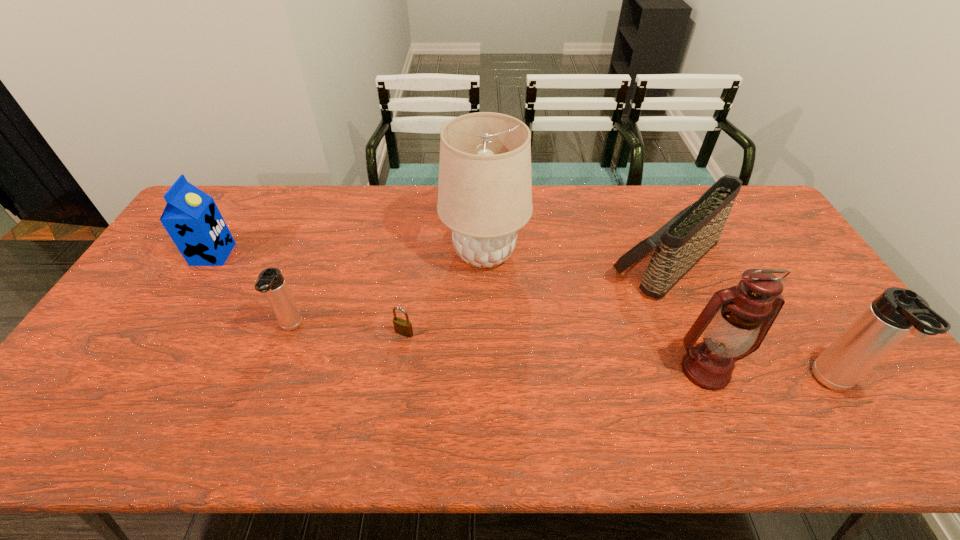
The width and height of the screenshot is (960, 540). Identify the location of object located in the left edge section of the desktop. (191, 217).

The width and height of the screenshot is (960, 540). Find the location of `object that is at the right edge`. object that is at the right edge is located at coordinates (897, 312).

This screenshot has height=540, width=960. Identify the location of object located in the near right corner section of the desktop. (897, 312).

In the image, there is a desktop. Where is `vacant space at the far edge`? vacant space at the far edge is located at coordinates (433, 224).

Where is `vacant space at the near edge of the desktop`? vacant space at the near edge of the desktop is located at coordinates (328, 372).

Identify the location of free location at the left edge. The width and height of the screenshot is (960, 540). (180, 262).

In the image, there is a desktop. At what (x,y) coordinates should I click in order to perform the action: click on vacant space at the right edge. Please return your answer as a coordinate pair (x, y). Looking at the image, I should click on (810, 273).

In the image, there is a desktop. At what (x,y) coordinates should I click in order to perform the action: click on vacant space at the far left corner. Please return your answer as a coordinate pair (x, y). Image resolution: width=960 pixels, height=540 pixels. Looking at the image, I should click on (230, 185).

This screenshot has height=540, width=960. What are the coordinates of `blank space at the near left corner` in the screenshot? It's located at (81, 402).

At what (x,y) coordinates should I click in order to perform the action: click on free spot at the far right corner of the desktop. Please return your answer as a coordinate pair (x, y). The height and width of the screenshot is (540, 960). Looking at the image, I should click on (760, 202).